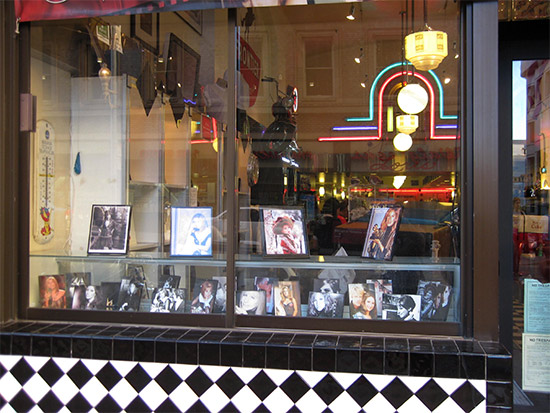
Locate an element on the screen. This screenshot has height=413, width=550. green neon light is located at coordinates (372, 104).